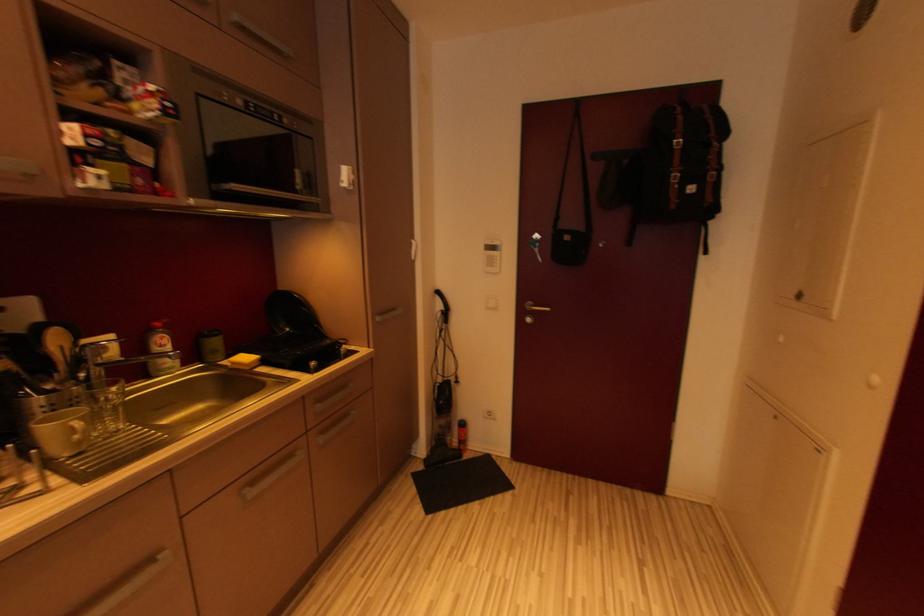
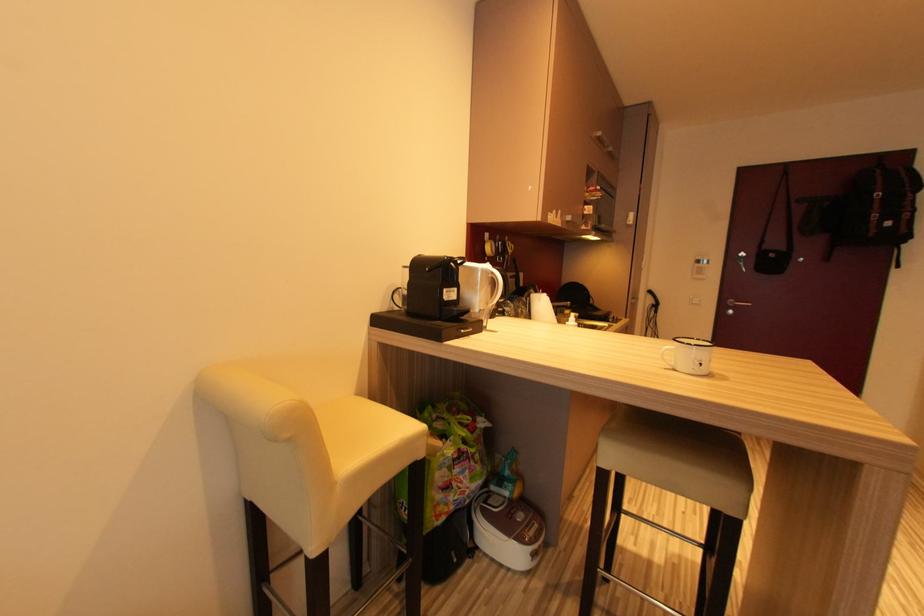
In a continuous first-person perspective shot, in which direction is the camera moving?

The cameraman moved toward left, backward.